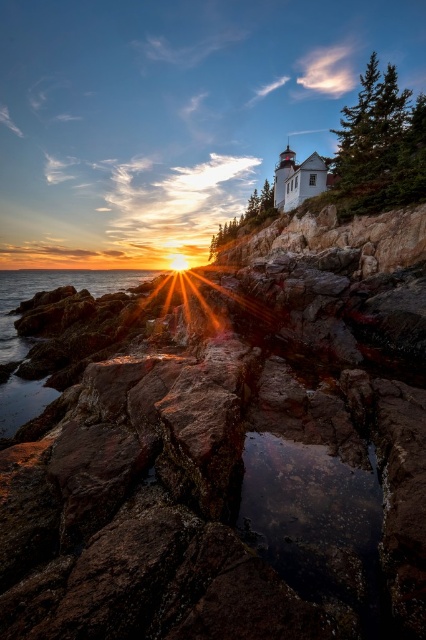
Does point (196, 554) come behind point (54, 288)?

No.

Is rusty stone rocks at center smaller than translucent wet rocks at lower left?

Indeed, rusty stone rocks at center has a smaller size compared to translucent wet rocks at lower left.

Is point (278, 365) farther from viewer compared to point (0, 349)?

No, it is not.

This screenshot has height=640, width=426. In order to click on rusty stone rocks at center in this screenshot , I will do `click(224, 444)`.